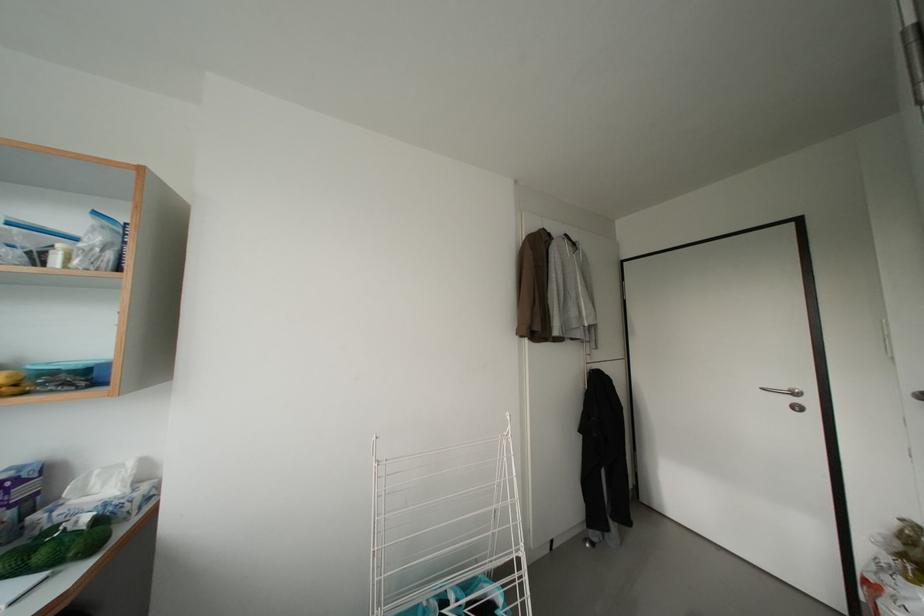
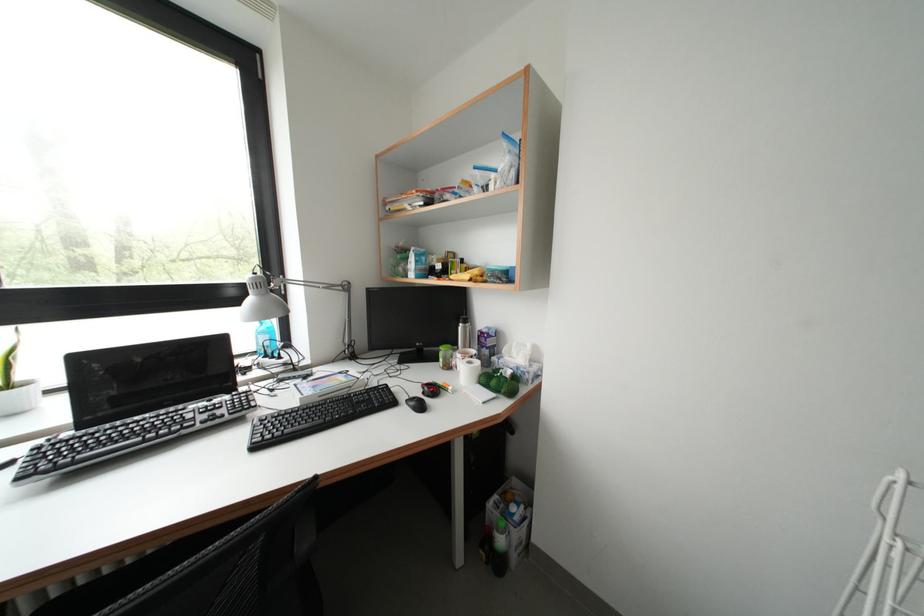
The point at [49,561] is marked in the first image. Where is the corresponding point in the second image?

(500, 387)